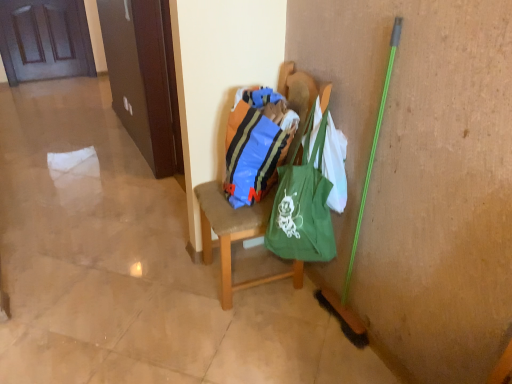
Find the location of a particular element. Image resolution: width=512 pixels, height=384 pixels. space that is in front of wooden door at upper left is located at coordinates (48, 89).